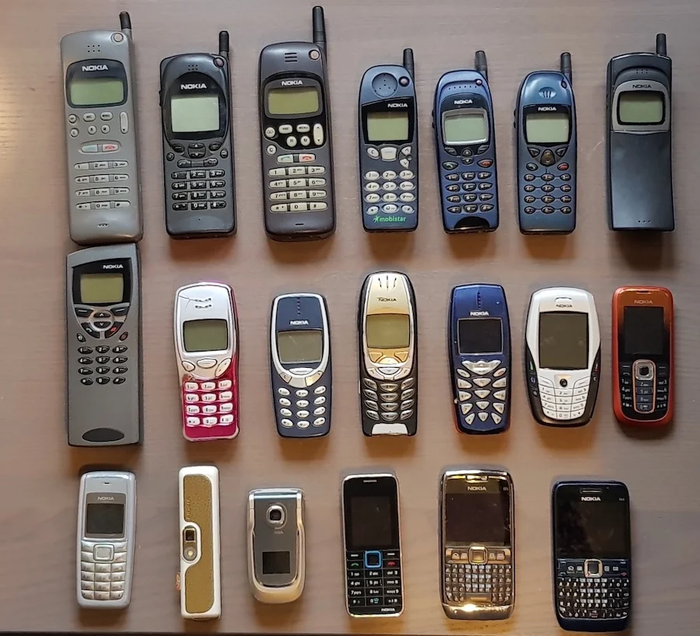
Identify the location of telephones in first row. (638, 147), (545, 167), (465, 170), (370, 173), (286, 173), (195, 179), (80, 172).